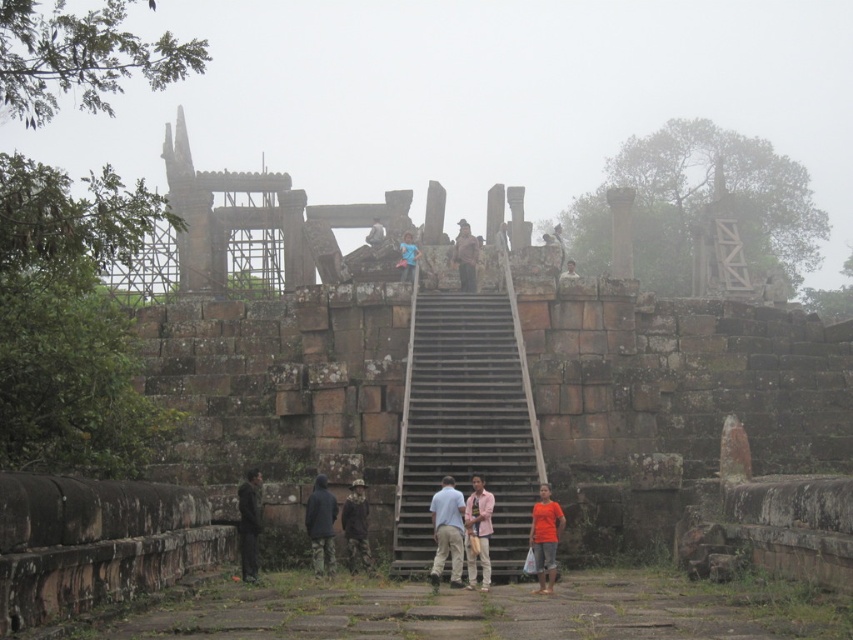
Is brown leather jacket at upper center shorter than light brown wooden post at upper center?

In fact, brown leather jacket at upper center may be taller than light brown wooden post at upper center.

Identify the location of brown leather jacket at upper center. (465, 257).

Is orange t-shirt at center taller than light brown wooden post at upper center?

Incorrect, orange t-shirt at center's height is not larger of light brown wooden post at upper center's.

The width and height of the screenshot is (853, 640). What do you see at coordinates (544, 538) in the screenshot?
I see `orange t-shirt at center` at bounding box center [544, 538].

Locate an element on the screen. The width and height of the screenshot is (853, 640). orange t-shirt at center is located at coordinates (544, 538).

Is brown leather jacket at upper center above blue fabric at upper center?

Indeed, brown leather jacket at upper center is positioned over blue fabric at upper center.

Can you confirm if brown leather jacket at upper center is smaller than blue fabric at upper center?

Actually, brown leather jacket at upper center might be larger than blue fabric at upper center.

Who is more forward, (x=469, y=289) or (x=403, y=266)?

Point (x=469, y=289)

Where is `brown leather jacket at upper center`? The width and height of the screenshot is (853, 640). brown leather jacket at upper center is located at coordinates (465, 257).